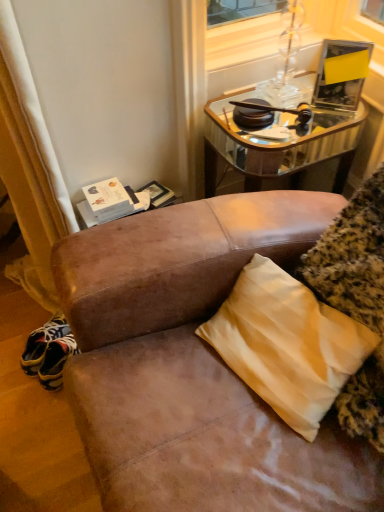
Identify the location of free spot above mirrored glass table at upper right (from a real-world perspective). (298, 100).